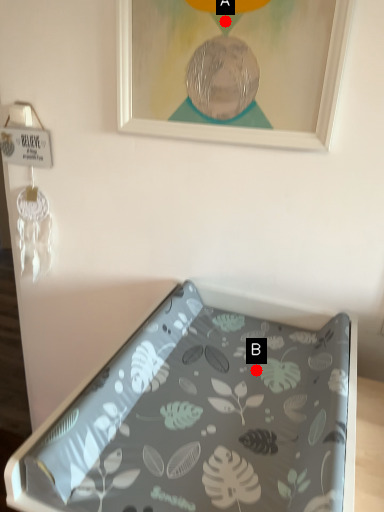
Question: Two points are circled on the image, labeled by A and B beside each circle. Which point is farther to the camera?

Choices:
 (A) A is further
 (B) B is further

Answer: (B)